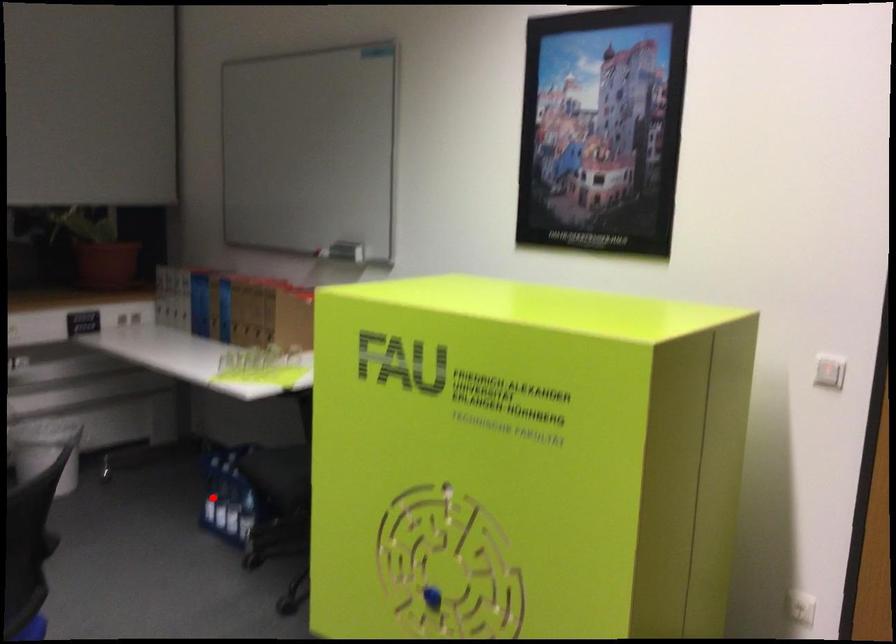
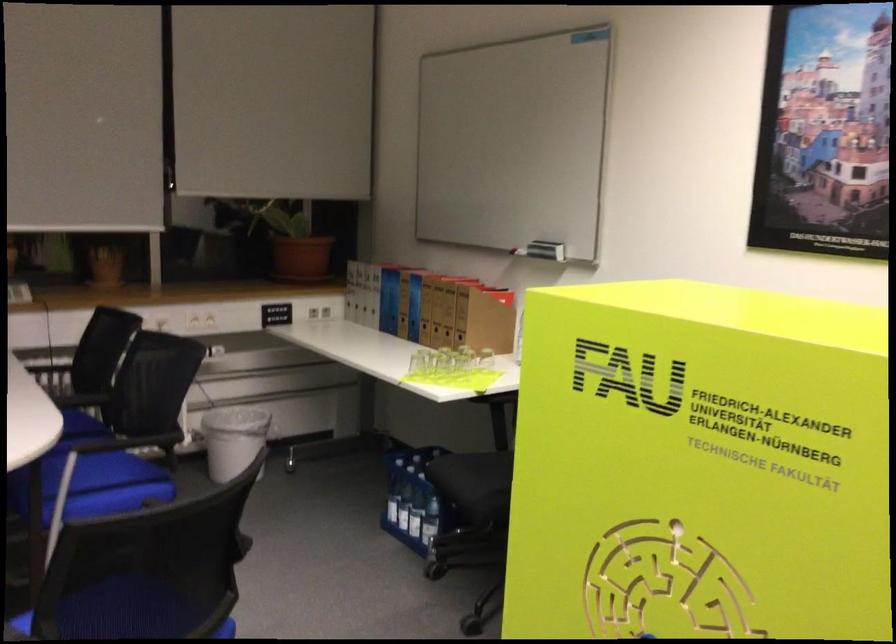
Find the pixel in the second image that matches the highlighted location in the first image.

(392, 500)